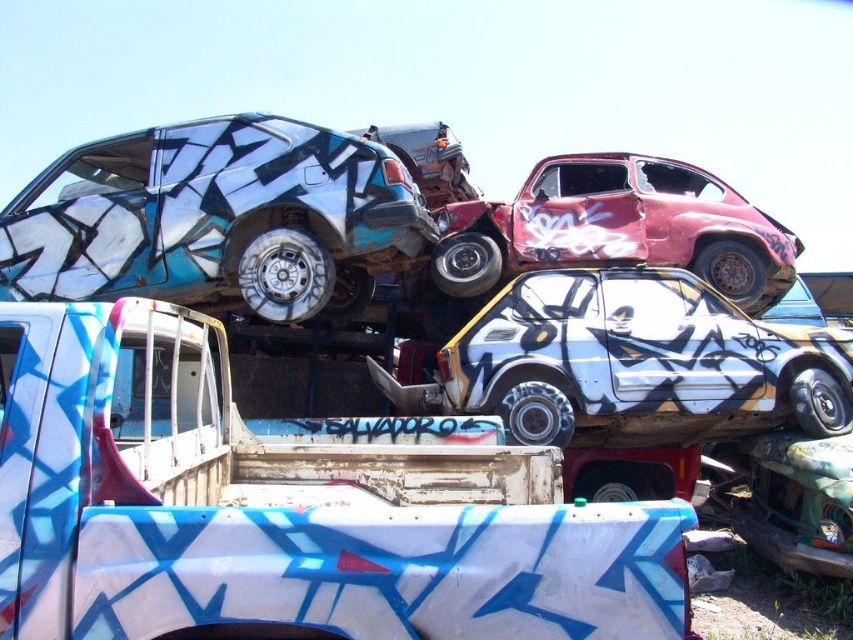
Question: Is blue painted metal car at upper left smaller than white matte car at center?

Choices:
 (A) no
 (B) yes

Answer: (A)

Question: Is white matte truck bed at lower left to the right of rusty metal car at upper center from the viewer's perspective?

Choices:
 (A) no
 (B) yes

Answer: (A)

Question: Which of the following is the farthest from the observer?

Choices:
 (A) (289, 504)
 (B) (332, 182)
 (C) (599, 170)
 (D) (804, 390)

Answer: (C)

Question: Considering the real-world distances, which object is closest to the white matte car at center?

Choices:
 (A) white matte truck bed at lower left
 (B) blue painted metal car at upper left

Answer: (B)

Question: Does blue painted metal car at upper left appear under white matte car at center?

Choices:
 (A) yes
 (B) no

Answer: (B)

Question: Which point is closer to the camera?

Choices:
 (A) (213, 275)
 (B) (409, 611)
 (C) (450, 385)

Answer: (B)